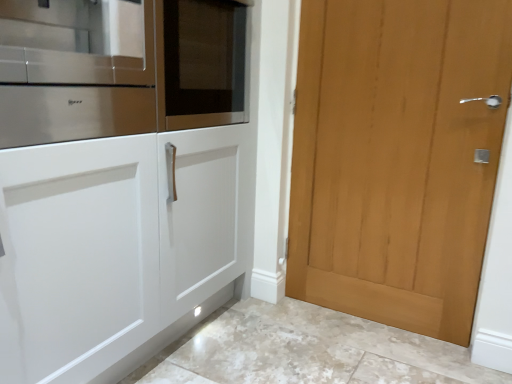
Question: Does white marble floor at lower center touch light brown wood door at right?

Choices:
 (A) no
 (B) yes

Answer: (A)

Question: Is white marble floor at lower center not close to light brown wood door at right?

Choices:
 (A) yes
 (B) no

Answer: (B)

Question: Considering the relative sizes of white marble floor at lower center and light brown wood door at right in the image provided, is white marble floor at lower center taller than light brown wood door at right?

Choices:
 (A) yes
 (B) no

Answer: (B)

Question: Is white marble floor at lower center positioned beyond the bounds of light brown wood door at right?

Choices:
 (A) no
 (B) yes

Answer: (B)

Question: Is light brown wood door at right completely or partially inside white marble floor at lower center?

Choices:
 (A) no
 (B) yes

Answer: (A)

Question: Can you confirm if white marble floor at lower center is positioned to the right of light brown wood door at right?

Choices:
 (A) no
 (B) yes

Answer: (A)

Question: Is light brown wood door at right completely or partially inside stainless steel oven at left?

Choices:
 (A) no
 (B) yes

Answer: (A)

Question: Is stainless steel oven at left oriented towards light brown wood door at right?

Choices:
 (A) yes
 (B) no

Answer: (B)

Question: Is stainless steel oven at left positioned far away from light brown wood door at right?

Choices:
 (A) no
 (B) yes

Answer: (A)

Question: Considering the relative positions of stainless steel oven at left and light brown wood door at right in the image provided, is stainless steel oven at left to the left of light brown wood door at right from the viewer's perspective?

Choices:
 (A) yes
 (B) no

Answer: (A)

Question: From a real-world perspective, does stainless steel oven at left sit lower than light brown wood door at right?

Choices:
 (A) yes
 (B) no

Answer: (B)

Question: Can you confirm if stainless steel oven at left is smaller than light brown wood door at right?

Choices:
 (A) yes
 (B) no

Answer: (A)

Question: Can you see light brown wood door at right touching white marble floor at lower center?

Choices:
 (A) yes
 (B) no

Answer: (B)